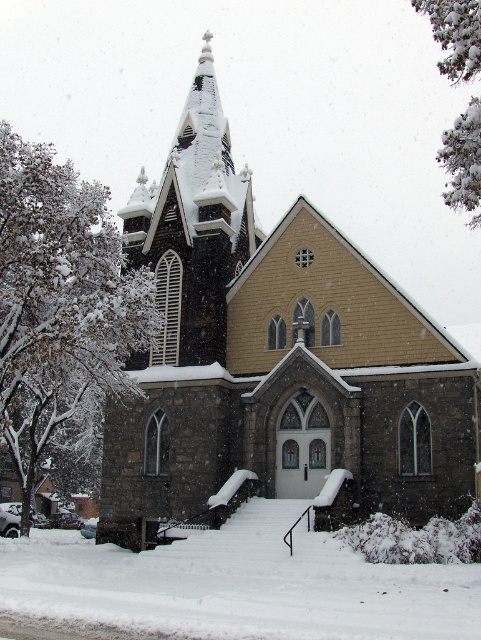
Question: Does stone church at center lie behind white fluffy snow at center?

Choices:
 (A) yes
 (B) no

Answer: (A)

Question: Among these objects, which one is farthest from the camera?

Choices:
 (A) stone church at center
 (B) white fluffy snow at center

Answer: (A)

Question: Is stone church at center smaller than white fluffy snow at center?

Choices:
 (A) no
 (B) yes

Answer: (A)

Question: Can you confirm if stone church at center is bigger than white fluffy snow at center?

Choices:
 (A) yes
 (B) no

Answer: (A)

Question: Among these points, which one is nearest to the camera?

Choices:
 (A) (121, 412)
 (B) (233, 554)

Answer: (B)